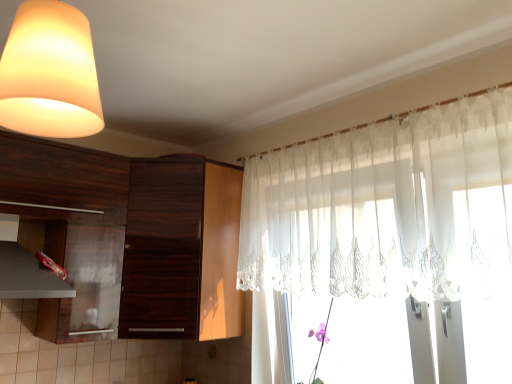
Question: Considering the positions of point (139, 215) and point (73, 102), is point (139, 215) closer or farther from the camera than point (73, 102)?

Choices:
 (A) farther
 (B) closer

Answer: (A)

Question: Choose the correct answer: Is dark wood cabinet at center, placed as the second cabinetry when sorted from left to right, inside matte white lampshade at upper left or outside it?

Choices:
 (A) inside
 (B) outside

Answer: (B)

Question: Based on their relative distances, which object is farther from the matte black exhaust hood at lower left?

Choices:
 (A) matte white lampshade at upper left
 (B) sheer white curtain at upper right
 (C) dark wood cabinet at left, the first cabinetry positioned from the left
 (D) dark wood cabinet at center, which appears as the first cabinetry when viewed from the right

Answer: (B)

Question: Estimate the real-world distances between objects in this image. Which object is farther from the dark wood cabinet at left, the first cabinetry positioned from the left?

Choices:
 (A) matte white lampshade at upper left
 (B) matte black exhaust hood at lower left
 (C) sheer white curtain at upper right
 (D) dark wood cabinet at center, placed as the second cabinetry when sorted from left to right

Answer: (A)